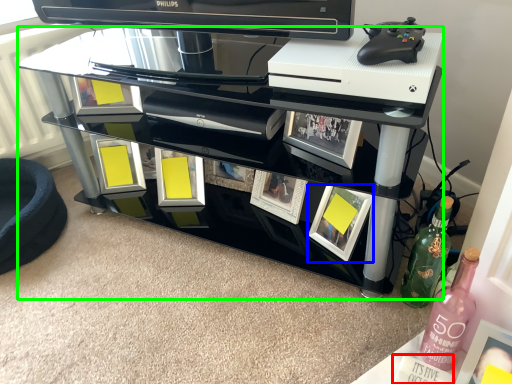
Question: Estimate the real-world distances between objects in this image. Which object is farther from magazine (highlighted by a red box), picture frame (highlighted by a blue box) or table (highlighted by a green box)?

Choices:
 (A) picture frame
 (B) table

Answer: (B)